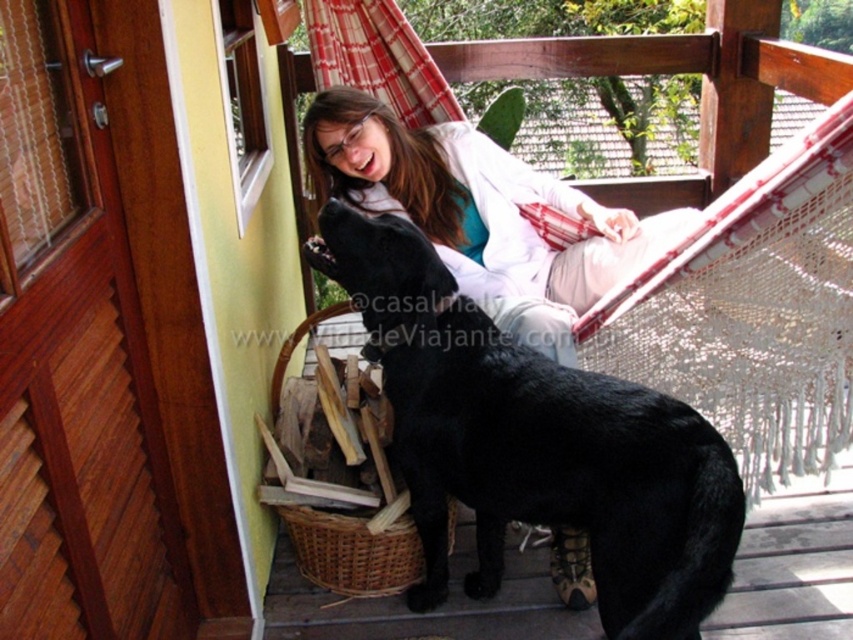
Which of these two, black glossy fur at lower center or matte white coat at upper center, stands taller?

Standing taller between the two is black glossy fur at lower center.

Is black glossy fur at lower center positioned in front of matte white coat at upper center?

Yes.

Find the location of a particular element. The height and width of the screenshot is (640, 853). black glossy fur at lower center is located at coordinates (535, 442).

You are a GUI agent. You are given a task and a screenshot of the screen. Output one action in this format:
    pyautogui.click(x=<x>, y=<y>)
    Task: Click on the black glossy fur at lower center
    This screenshot has width=853, height=640.
    Given the screenshot: What is the action you would take?
    pyautogui.click(x=535, y=442)